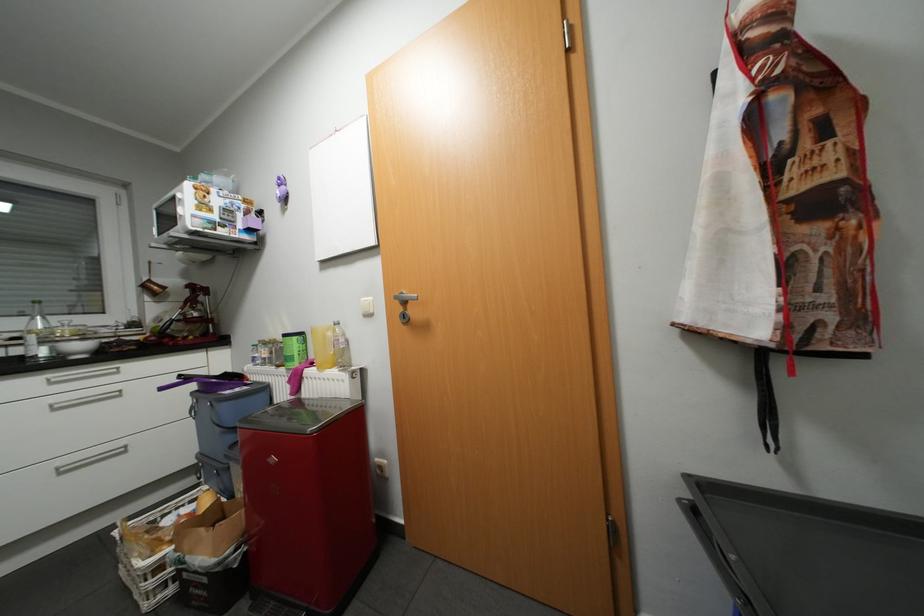
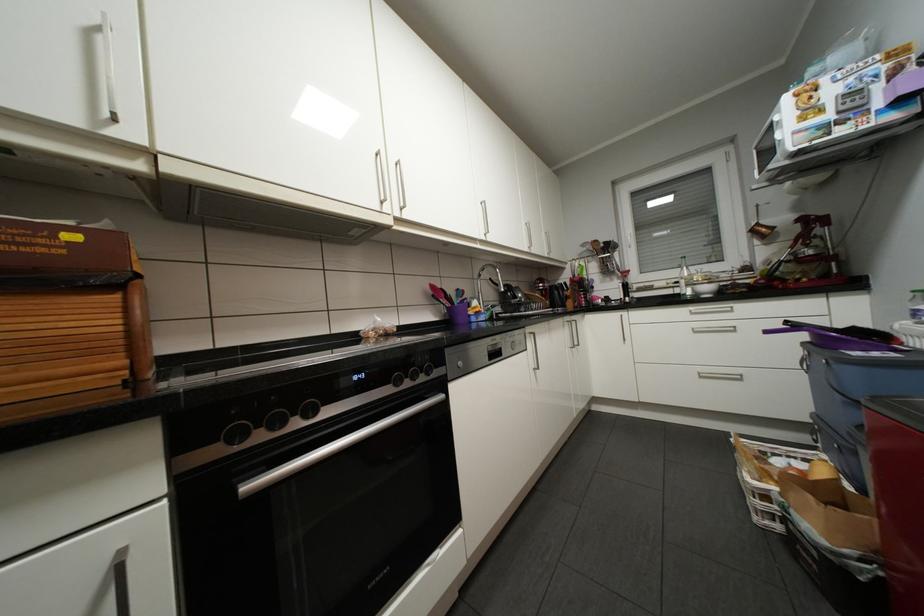
In the second image, find the point that corresponds to (30,357) in the first image.

(687, 294)